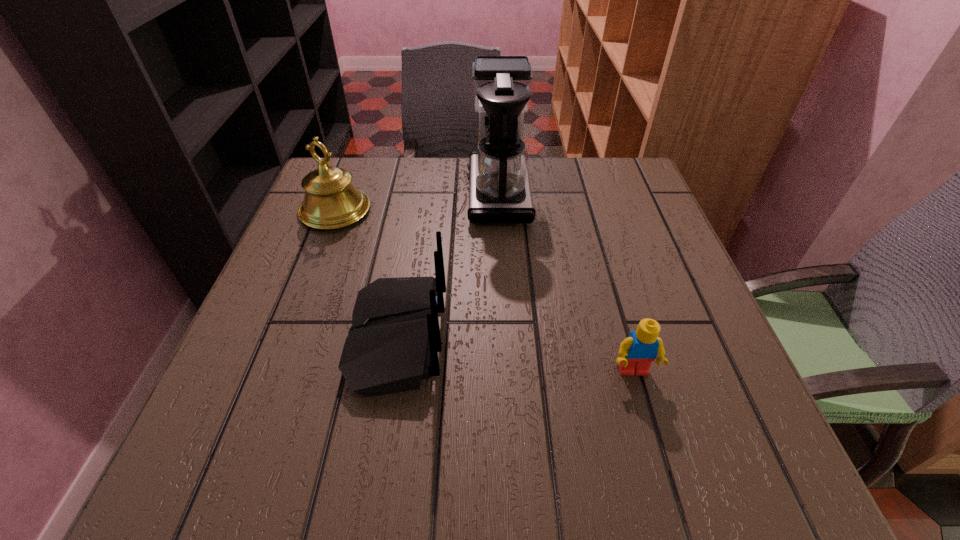
Identify the location of vacant space that's between the third object from right to left and the rightmost object. The image size is (960, 540). (516, 355).

Find the location of `vacant area that lies between the third object from left to right and the leftmost object`. vacant area that lies between the third object from left to right and the leftmost object is located at coordinates (417, 202).

Where is `unoccupied area between the coffee maker and the router`? The height and width of the screenshot is (540, 960). unoccupied area between the coffee maker and the router is located at coordinates (447, 266).

Where is `free space that is in between the bell and the coffee maker`? free space that is in between the bell and the coffee maker is located at coordinates (417, 202).

Locate an element on the screen. object that stands as the second closest to the Lego is located at coordinates (500, 192).

You are a GUI agent. You are given a task and a screenshot of the screen. Output one action in this format:
    pyautogui.click(x=<x>, y=<y>)
    Task: Click on the object that is the second closest to the leftmost object
    
    Given the screenshot: What is the action you would take?
    pyautogui.click(x=500, y=192)